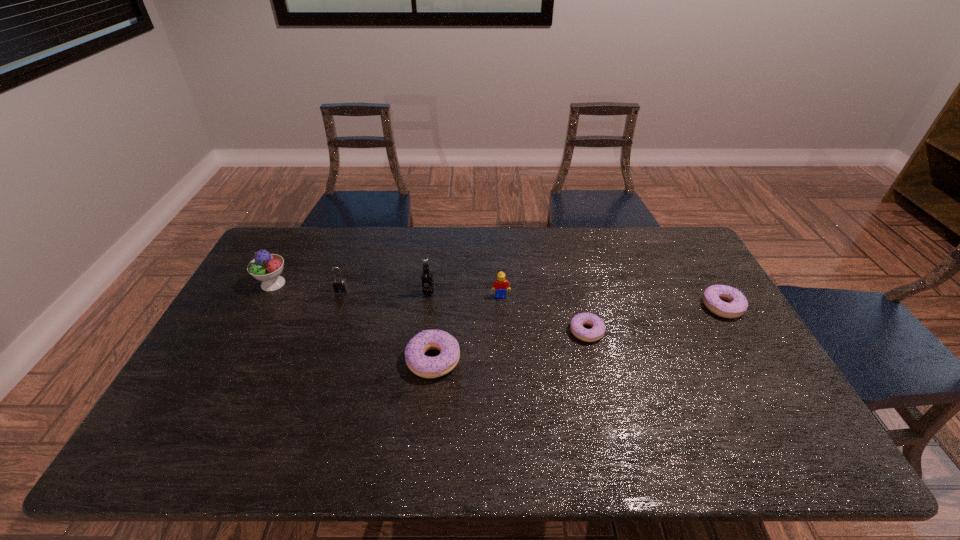
The image size is (960, 540). What are the coordinates of `free space at the near edge of the desktop` in the screenshot? It's located at [x=320, y=413].

At what (x,y) coordinates should I click in order to perform the action: click on vacant point at the right edge. Please return your answer as a coordinate pair (x, y). This screenshot has height=540, width=960. Looking at the image, I should click on (724, 327).

In the image, there is a desktop. Where is `vacant space at the far left corner`? The image size is (960, 540). vacant space at the far left corner is located at coordinates (281, 232).

Find the location of a particular element. The width and height of the screenshot is (960, 540). unoccupied area between the Lego and the padlock is located at coordinates (420, 293).

Identify the location of free space between the third shortest object and the icecream. This screenshot has height=540, width=960. (x=353, y=322).

Locate an element on the screen. The height and width of the screenshot is (540, 960). empty space that is in between the root beer and the icecream is located at coordinates (351, 289).

This screenshot has width=960, height=540. Identify the location of free space between the leftmost object and the shortest object. (430, 308).

The image size is (960, 540). What are the coordinates of `free area in between the fifth object from left to right and the icecream` in the screenshot? It's located at (387, 290).

You are a GUI agent. You are given a task and a screenshot of the screen. Output one action in this format:
    pyautogui.click(x=<x>, y=<y>)
    Task: Click on the vacant region between the rightmost doughnut and the root beer
    The height and width of the screenshot is (540, 960).
    Given the screenshot: What is the action you would take?
    pyautogui.click(x=575, y=300)

The image size is (960, 540). Identify the location of free space between the root beer and the leftmost doughnut. (431, 327).